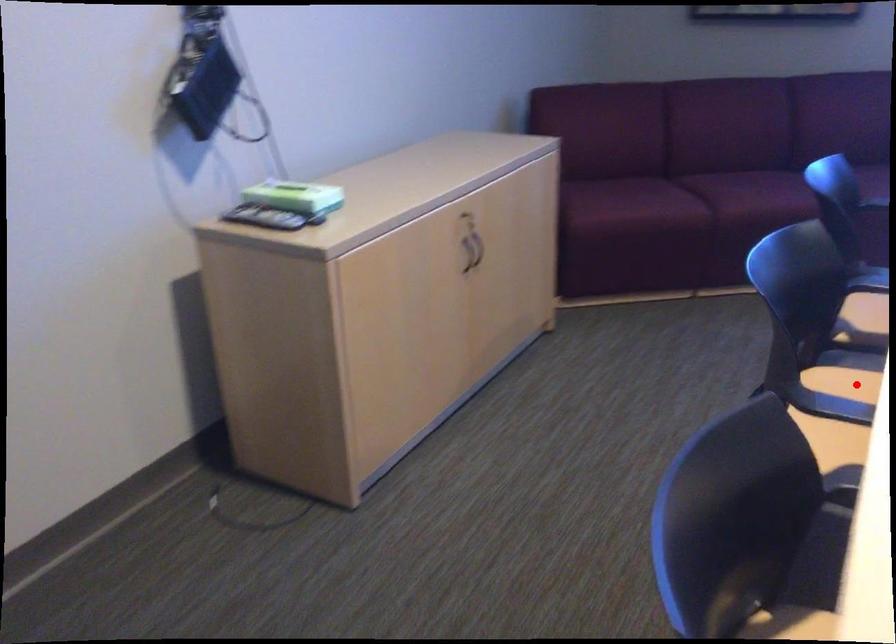
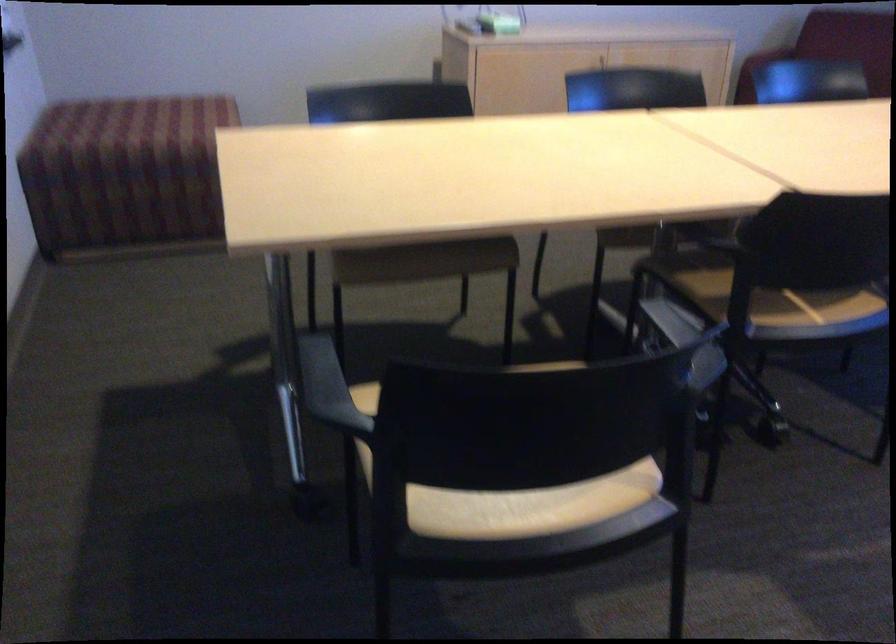
Question: I am providing you with two images of the same scene from different viewpoints. A red point is marked on the first image. Can you still see the location of the red point in image 2?

Choices:
 (A) Yes
 (B) No

Answer: (B)